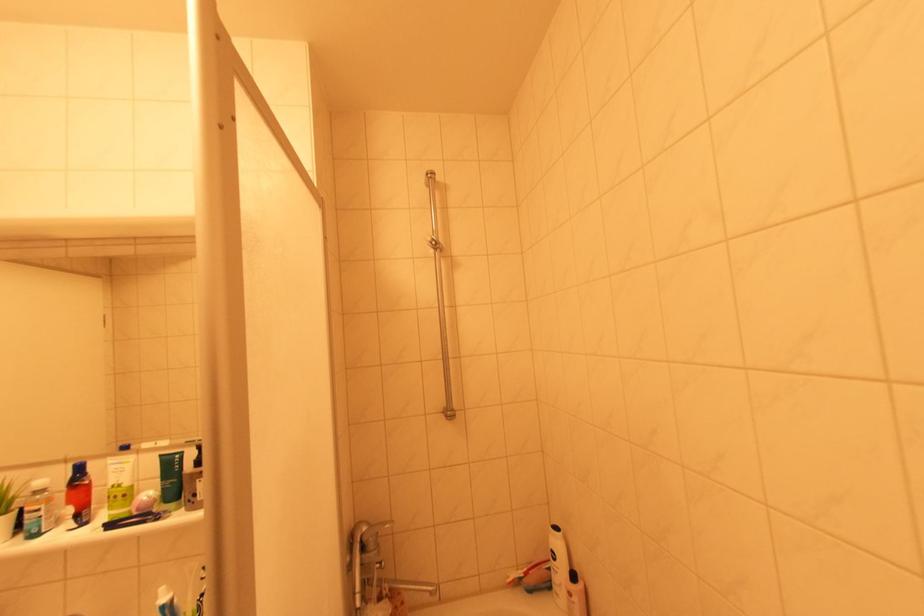
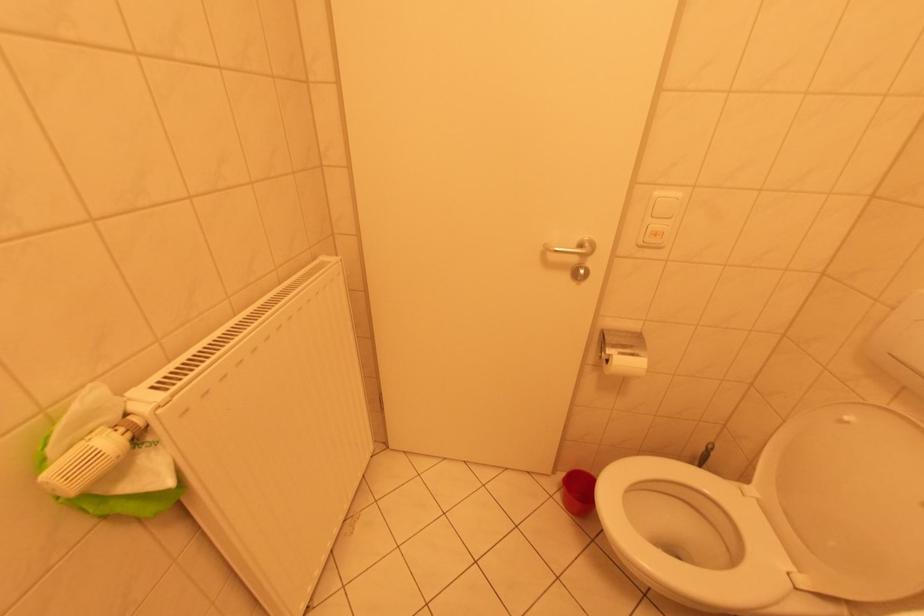
The images are taken continuously from a first-person perspective. In which direction is your viewpoint rotating?

The rotation direction of the camera is left-down.